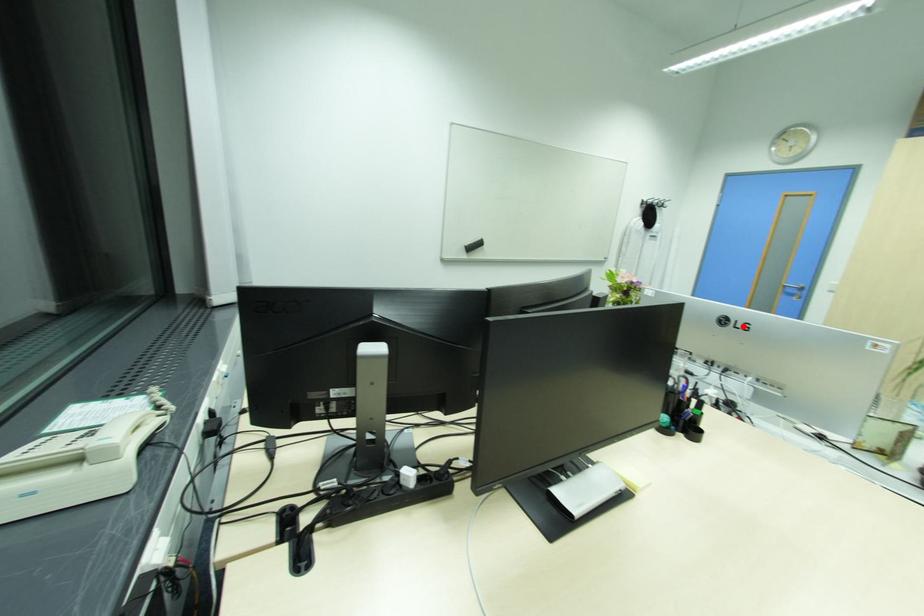
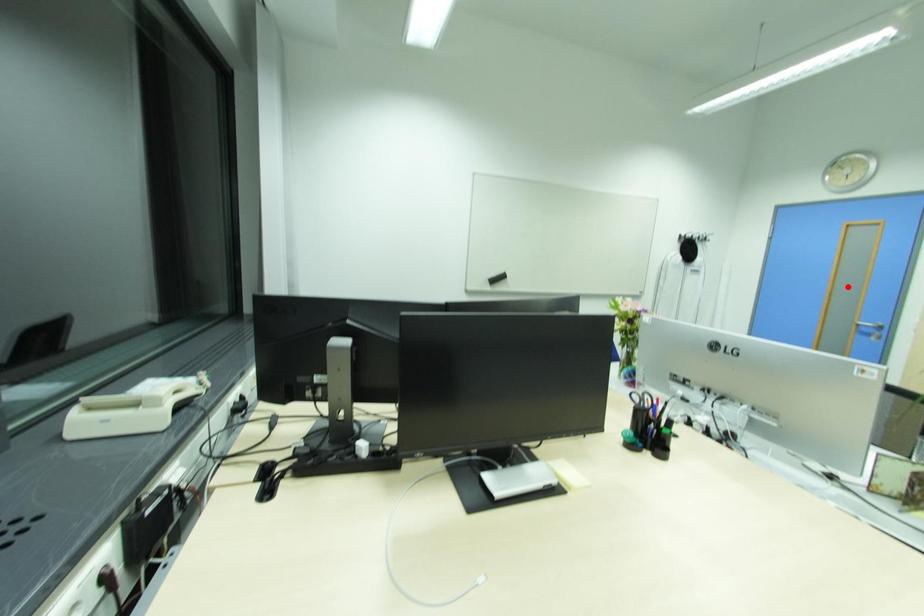
I am providing you with two images of the same scene from different viewpoints. A red point is marked on the first image and another point is marked on the second image. Are the points marked in image1 and image2 representing the same 3D position?

No